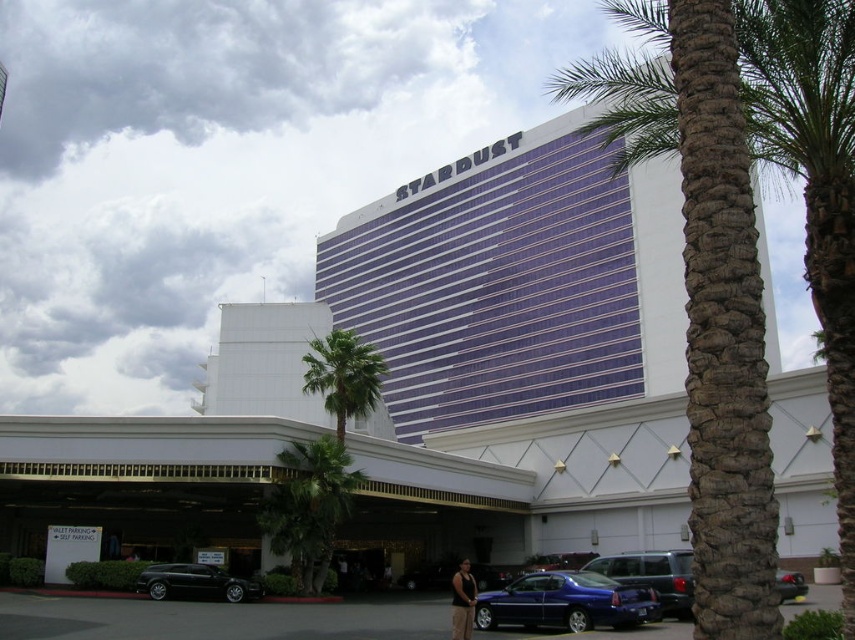
Does matte black suv at lower right have a lesser width compared to shiny black car at lower right?

Correct, matte black suv at lower right's width is less than shiny black car at lower right's.

At what (x,y) coordinates should I click in order to perform the action: click on matte black suv at lower right. Please return your answer as a coordinate pair (x, y). Looking at the image, I should click on (653, 576).

This screenshot has width=855, height=640. I want to click on matte black suv at lower right, so click(x=653, y=576).

Locate an element on the screen. This screenshot has width=855, height=640. green leafy palm tree at lower center is located at coordinates (310, 506).

Who is lower down, green leafy palm tree at lower center or shiny black sedan at lower left?

shiny black sedan at lower left is lower down.

Find the location of `green leafy palm tree at lower center`. green leafy palm tree at lower center is located at coordinates (310, 506).

Between point (584, 568) and point (146, 573), which one is positioned behind?

Positioned behind is point (146, 573).

Between matte black suv at lower right and shiny black sedan at lower left, which one has less height?

With less height is shiny black sedan at lower left.

Is point (671, 566) closer to viewer compared to point (251, 588)?

Yes.

At what (x,y) coordinates should I click in order to perform the action: click on matte black suv at lower right. Please return your answer as a coordinate pair (x, y). Looking at the image, I should click on (653, 576).